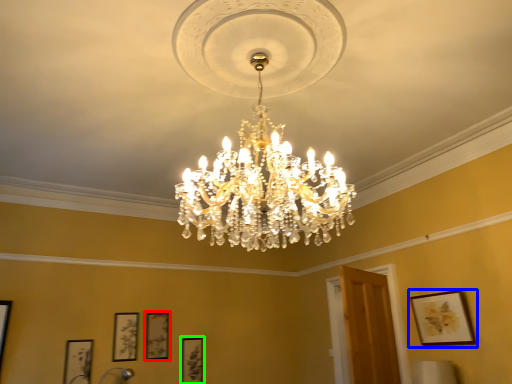
Question: Which object is the closest to the picture frame (highlighted by a red box)? Choose among these: picture frame (highlighted by a blue box) or picture frame (highlighted by a green box).

Choices:
 (A) picture frame
 (B) picture frame

Answer: (B)